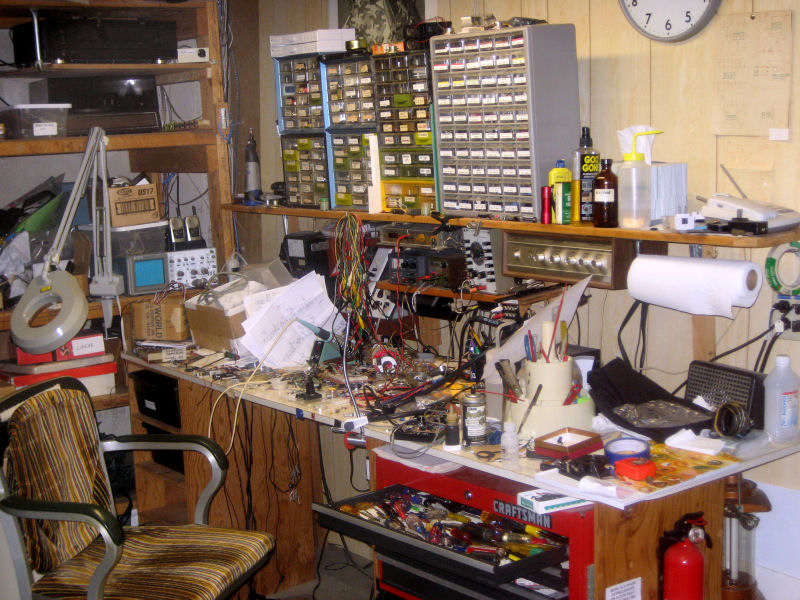
This screenshot has width=800, height=600. Identify the location of fire extinguisher. (692, 569).